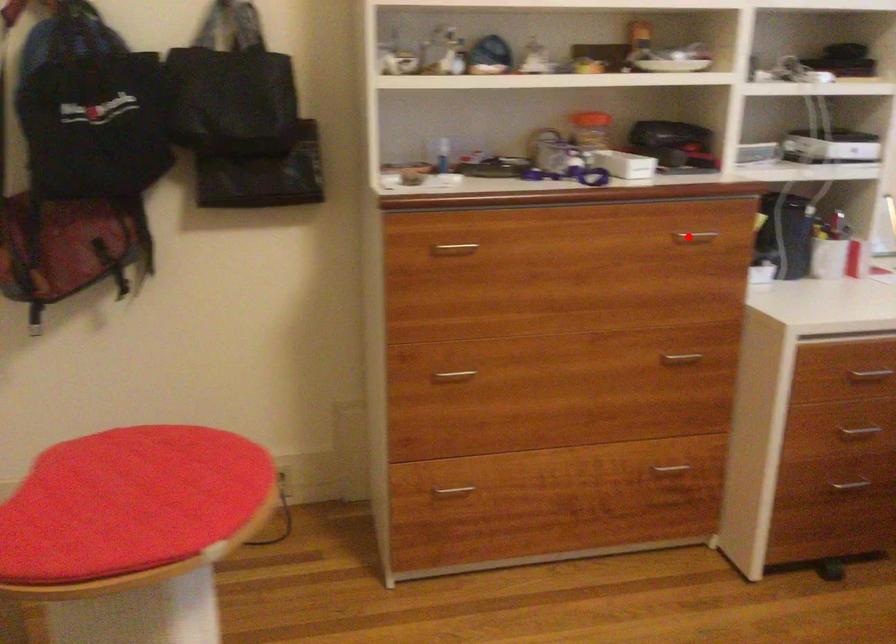
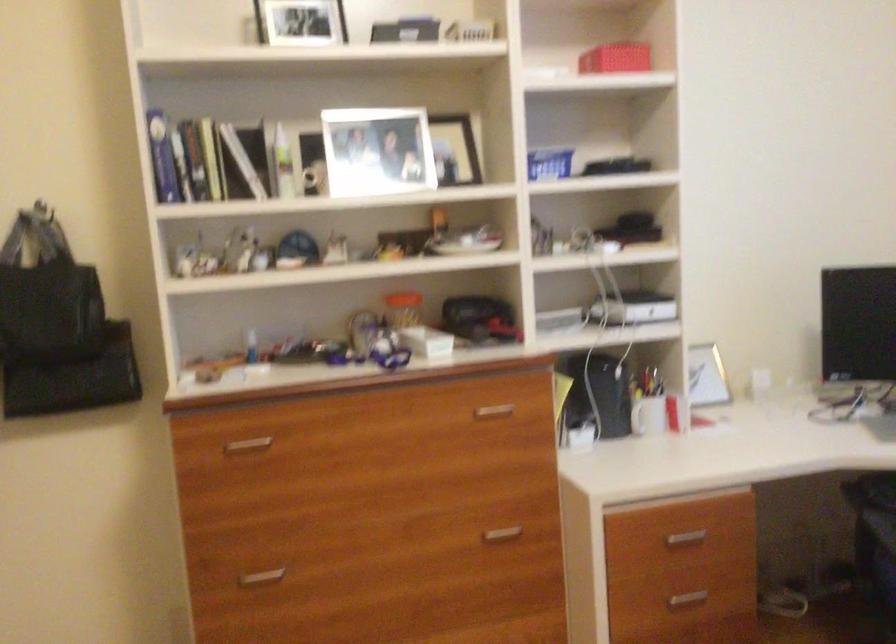
The point at the highlighted location is marked in the first image. Where is the corresponding point in the second image?

(493, 412)